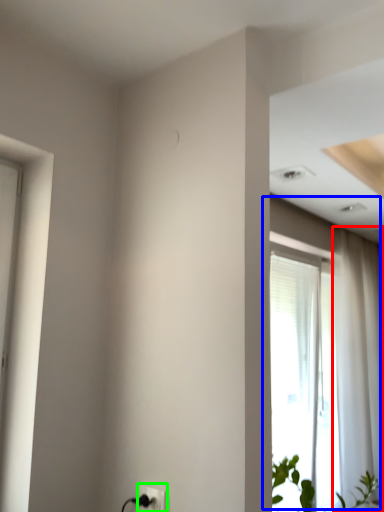
Question: Estimate the real-world distances between objects in this image. Which object is farther from curtain (highlighted by a red box), window (highlighted by a blue box) or electric outlet (highlighted by a green box)?

Choices:
 (A) window
 (B) electric outlet

Answer: (B)